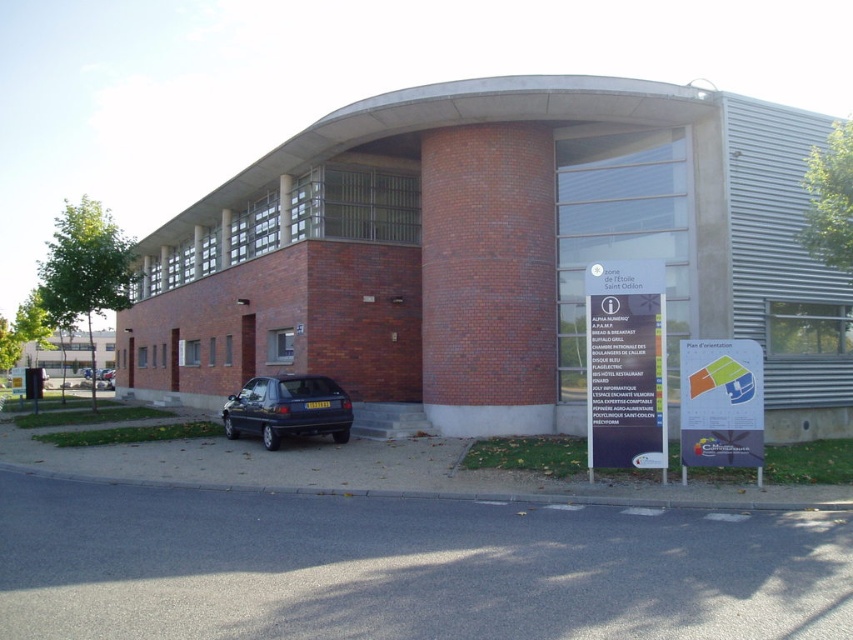
Question: Among these points, which one is farthest from the camera?

Choices:
 (A) (227, 436)
 (B) (520, 80)

Answer: (A)

Question: Can you confirm if white plastic sign at center is positioned to the right of matte dark blue hatchback at lower left?

Choices:
 (A) no
 (B) yes

Answer: (B)

Question: Where is white plastic sign at center located in relation to white plastic sign at lower right in the image?

Choices:
 (A) left
 (B) right

Answer: (A)

Question: Which point is closer to the camera?

Choices:
 (A) white plastic sign at center
 (B) white plastic sign at lower right
 (C) matte dark blue hatchback at lower left
 (D) brick building at center

Answer: (B)

Question: Does white plastic sign at center have a greater width compared to white plastic sign at lower right?

Choices:
 (A) no
 (B) yes

Answer: (A)

Question: Estimate the real-world distances between objects in this image. Which object is farther from the brick building at center?

Choices:
 (A) white plastic sign at lower right
 (B) matte dark blue hatchback at lower left

Answer: (A)